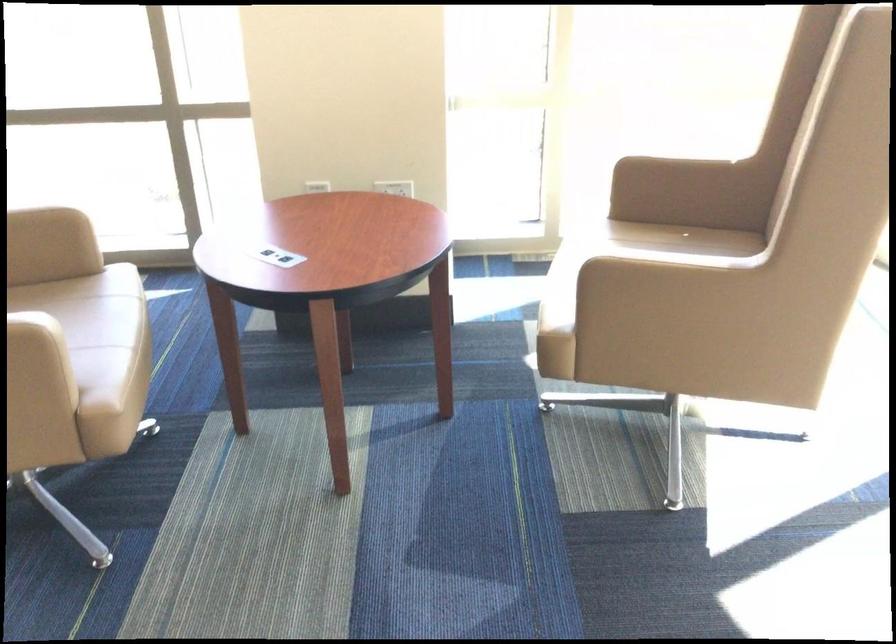
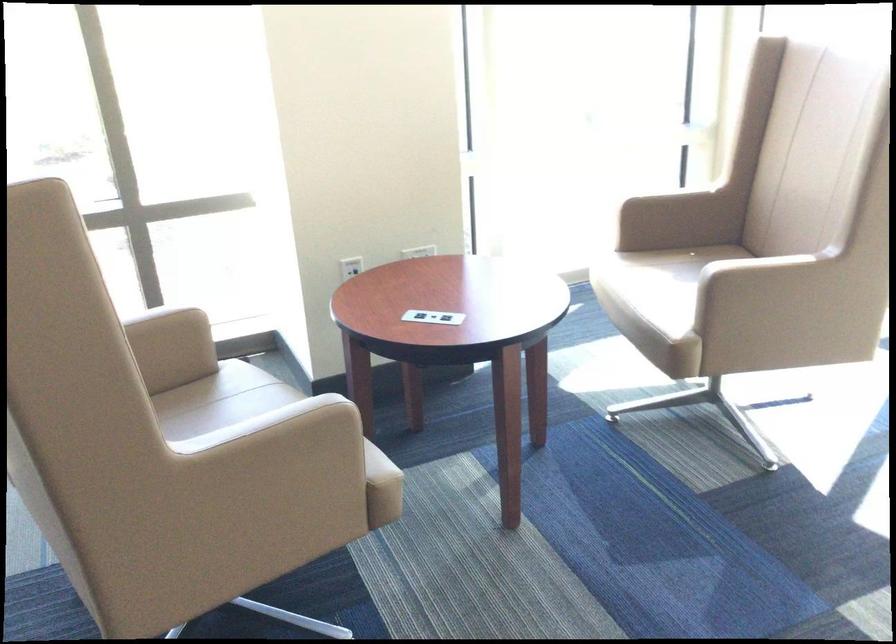
In the second image, find the point that corresponds to point (633, 269) in the first image.

(744, 270)